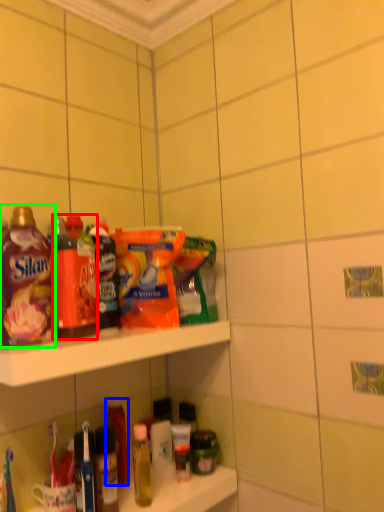
Question: Which object is the farthest from bottle (highlighted by a red box)? Choose among these: bottle (highlighted by a blue box) or bottle (highlighted by a green box).

Choices:
 (A) bottle
 (B) bottle

Answer: (A)